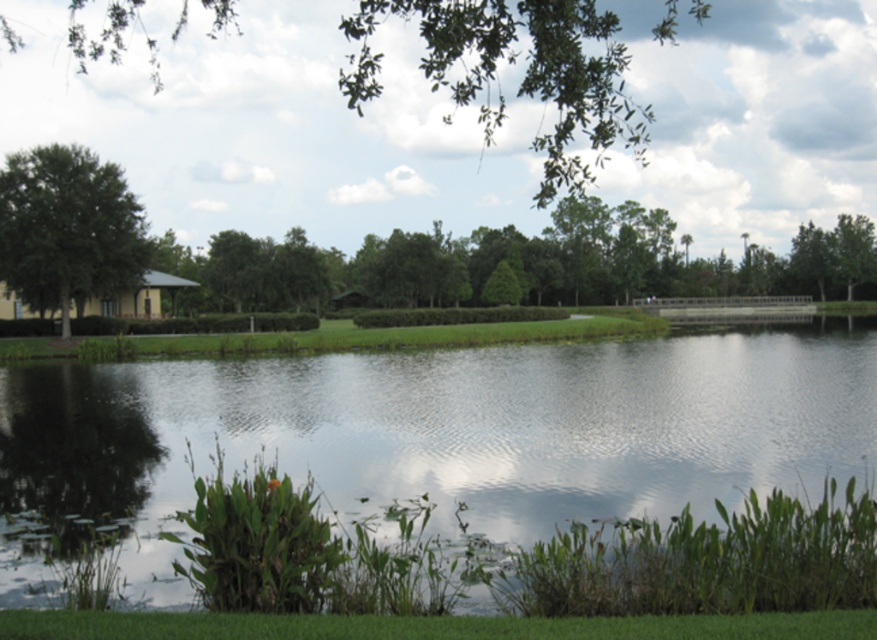
Is clear water at center behind green leafy tree at upper center?

Yes, clear water at center is behind green leafy tree at upper center.

In the scene shown: Which is more to the right, clear water at center or green leafy tree at upper center?

green leafy tree at upper center is more to the right.

At what (x,y) coordinates should I click in order to perform the action: click on clear water at center. Please return your answer as a coordinate pair (x, y). This screenshot has width=877, height=640. Looking at the image, I should click on (438, 435).

Can you confirm if clear water at center is taller than green leafy tree at left?

No, clear water at center is not taller than green leafy tree at left.

Image resolution: width=877 pixels, height=640 pixels. What do you see at coordinates (438, 435) in the screenshot?
I see `clear water at center` at bounding box center [438, 435].

This screenshot has height=640, width=877. In order to click on clear water at center in this screenshot , I will do `click(438, 435)`.

Can you confirm if green leafy tree at upper center is taller than green leafy tree at left?

Indeed, green leafy tree at upper center has a greater height compared to green leafy tree at left.

Which is behind, point (68, 38) or point (48, 193)?

The point (68, 38) is behind.

You are a GUI agent. You are given a task and a screenshot of the screen. Output one action in this format:
    pyautogui.click(x=<x>, y=<y>)
    Task: Click on the green leafy tree at upper center
    
    Given the screenshot: What is the action you would take?
    pyautogui.click(x=521, y=76)